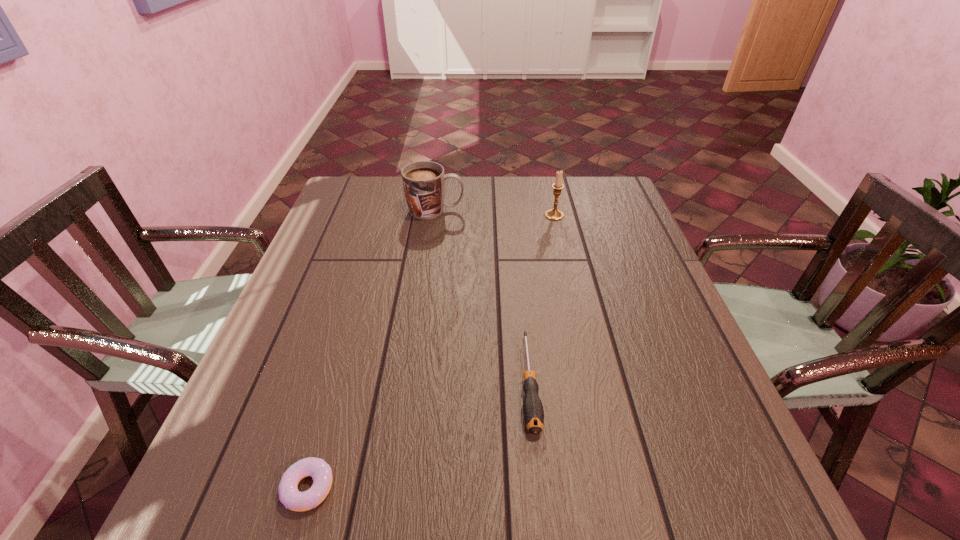
The height and width of the screenshot is (540, 960). In order to click on vacant point that satisfies the following two spatial constraints: 1. on the side of the mug with the handle; 2. on the back side of the screwdriver in this screenshot , I will do `click(411, 382)`.